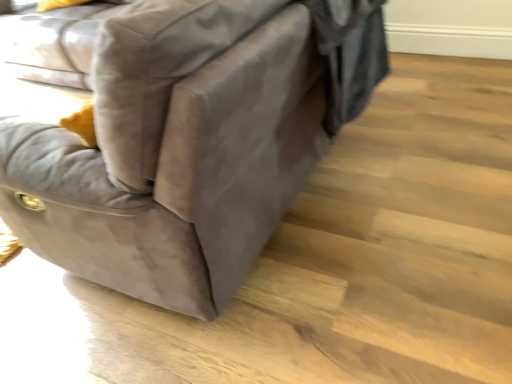
At what (x,y) coordinates should I click in order to perform the action: click on suede gray couch at lower left. Please return your answer as a coordinate pair (x, y). The height and width of the screenshot is (384, 512). Looking at the image, I should click on (191, 142).

Describe the element at coordinates (191, 142) in the screenshot. This screenshot has height=384, width=512. I see `suede gray couch at lower left` at that location.

Identify the location of suede gray couch at lower left. The width and height of the screenshot is (512, 384). (191, 142).